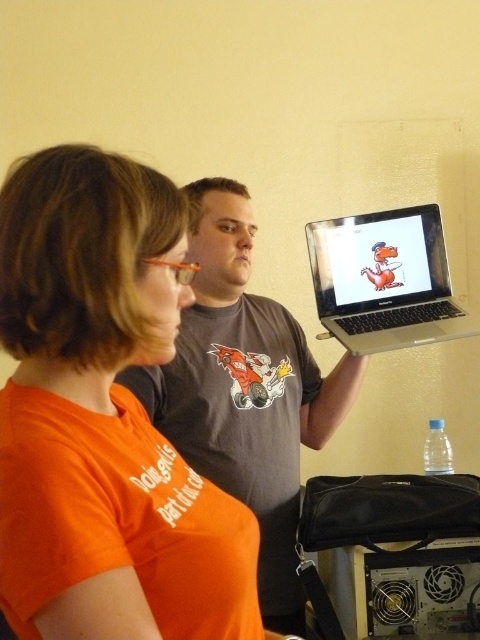
From the picture: You are a photographer setting up for a group photo. You need to ensure that the orange matte shirt at upper left and the gray matte shirt at center are both visible in the frame. Based on their positions, which person should be closer to the camera?

The orange matte shirt at upper left is in front of the gray matte shirt at center, so the person wearing the orange matte shirt at upper left is closer to the camera and will naturally be more visible. To ensure both are visible, adjust their positions so the gray matte shirt at center is moved slightly forward or the orange matte shirt at upper left steps back.

You are standing in the room and want to hand a document to the person wearing the gray matte shirt at center. Based on their position, which direction should you move to approach them?

The gray matte shirt at center is located at point [244,390], so you should move towards the center of the room to reach them.